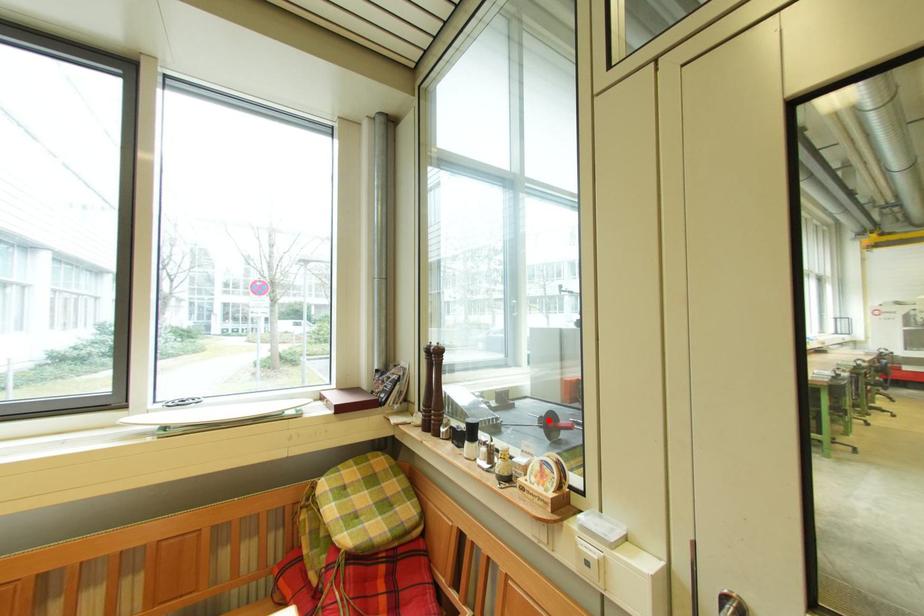
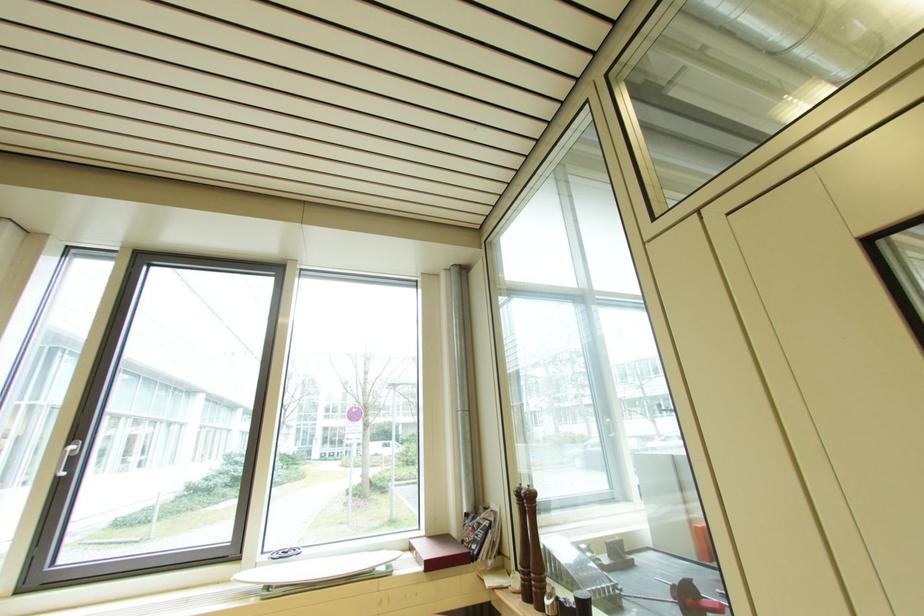
The point at the highlighted location is marked in the first image. Where is the corresponding point in the second image?

(681, 589)